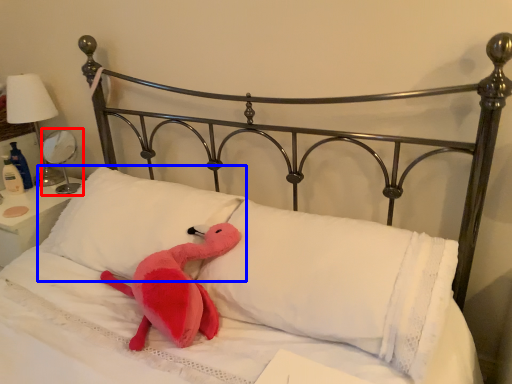
Question: Which object appears farthest to the camera in this image, table lamp (highlighted by a red box) or pillow (highlighted by a blue box)?

Choices:
 (A) table lamp
 (B) pillow

Answer: (A)